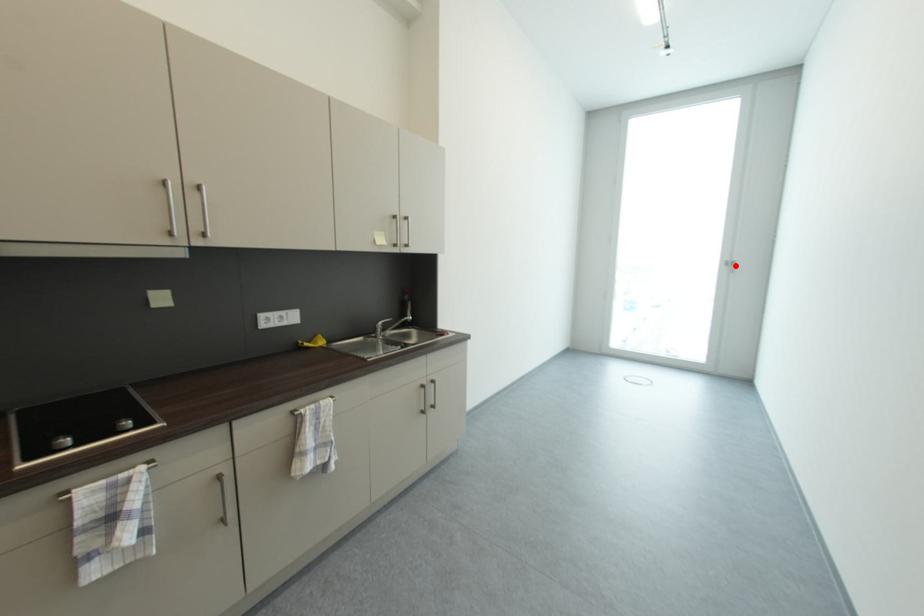
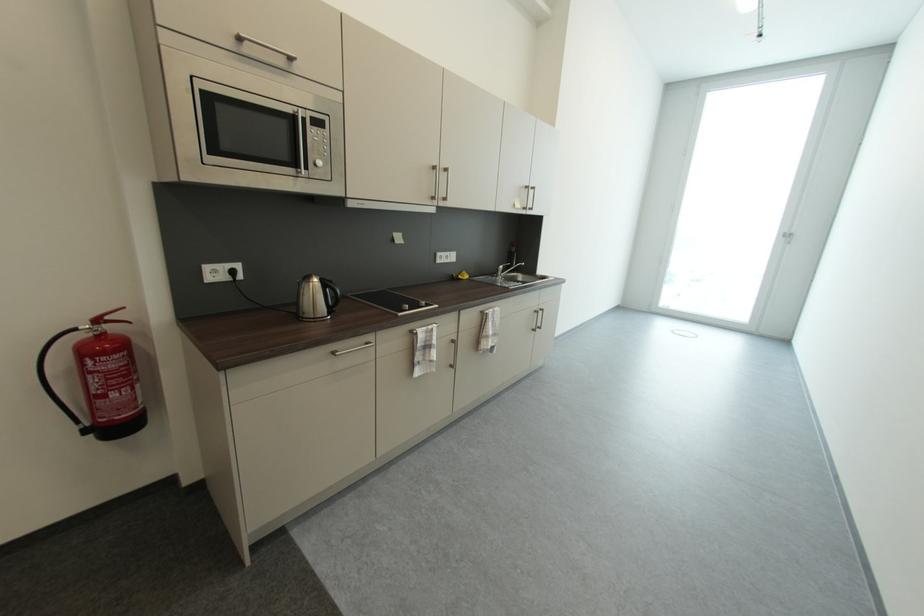
Question: I am providing you with two images of the same scene from different viewpoints. A red point is marked on the first image. Can you still see the location of the red point in image 2?

Choices:
 (A) Yes
 (B) No

Answer: (A)